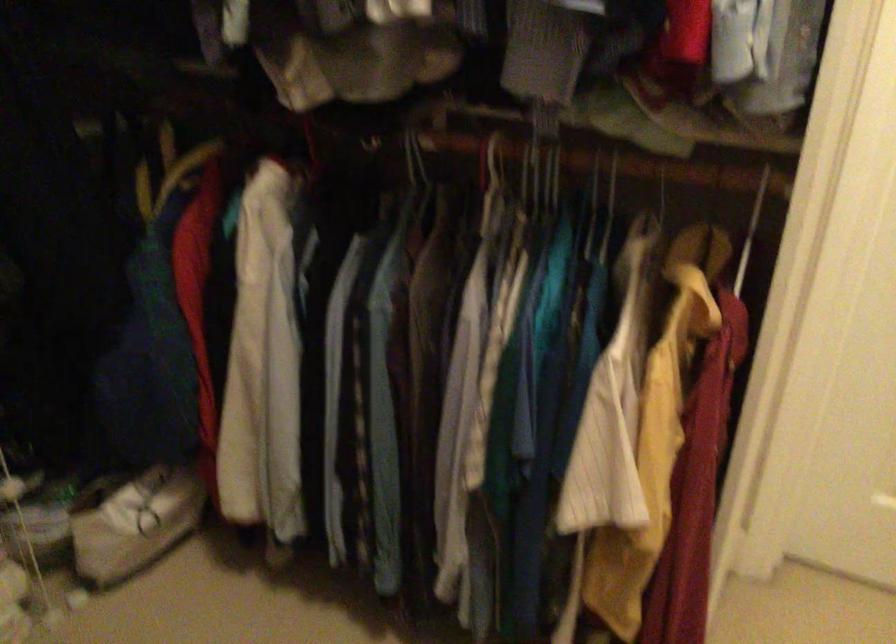
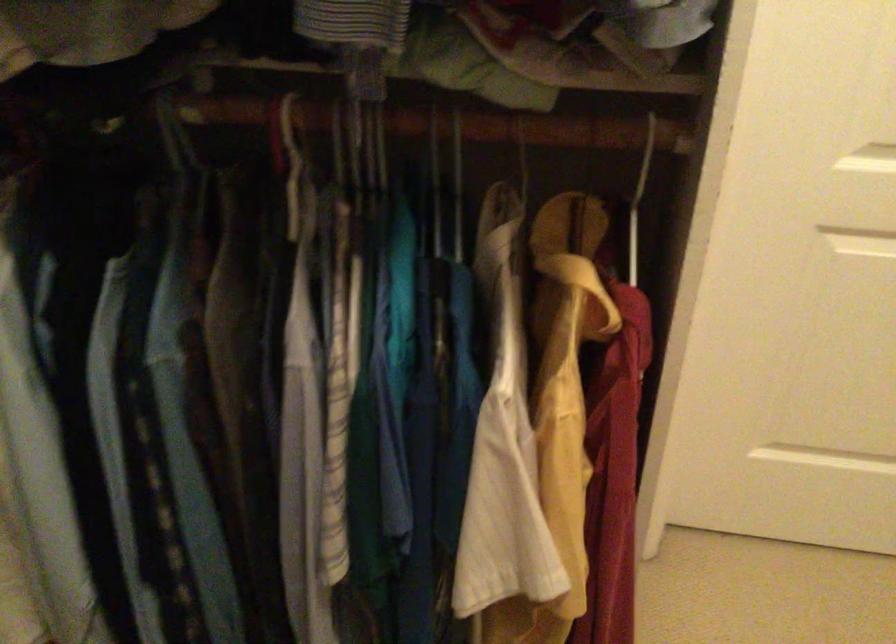
Question: In a continuous first-person perspective shot, in which direction is the camera moving?

Choices:
 (A) Left
 (B) Right
 (C) Forward
 (D) Backward

Answer: (C)